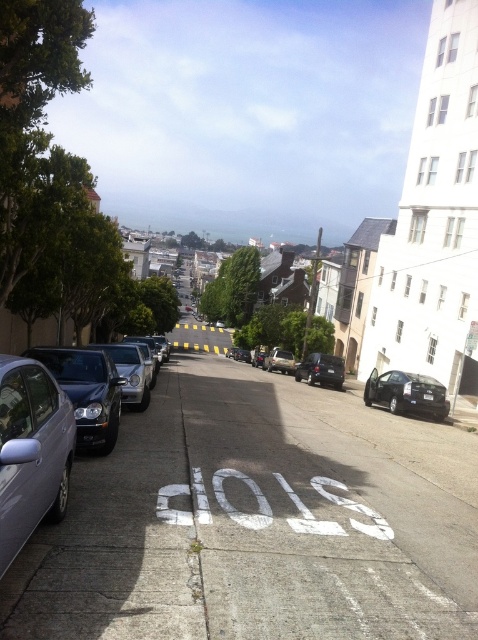
Question: Which of the following is the farthest from the observer?

Choices:
 (A) metallic silver sedan at center
 (B) black matte car at lower right

Answer: (A)

Question: Which of these objects is positioned closest to the metallic silver sedan at center?

Choices:
 (A) satin black sedan at left
 (B) satin silver sedan at lower left

Answer: (A)

Question: Is satin black sedan at left closer to the viewer compared to metallic silver sedan at center?

Choices:
 (A) no
 (B) yes

Answer: (B)

Question: Does white painted pavement at center lie in front of metallic silver sedan at center?

Choices:
 (A) no
 (B) yes

Answer: (B)

Question: Which object is the closest to the satin black sedan at left?

Choices:
 (A) satin silver sedan at center-left
 (B) shiny black suv at center
 (C) black matte car at lower right

Answer: (A)

Question: Does white painted pavement at center appear under satin black sedan at left?

Choices:
 (A) yes
 (B) no

Answer: (A)